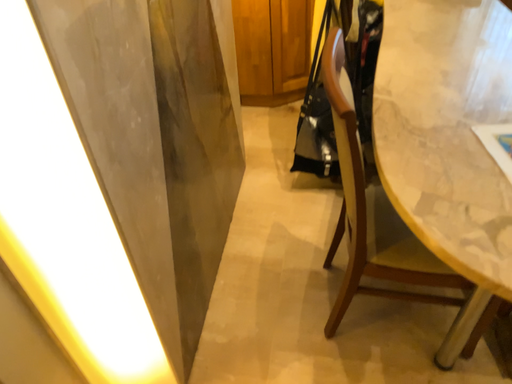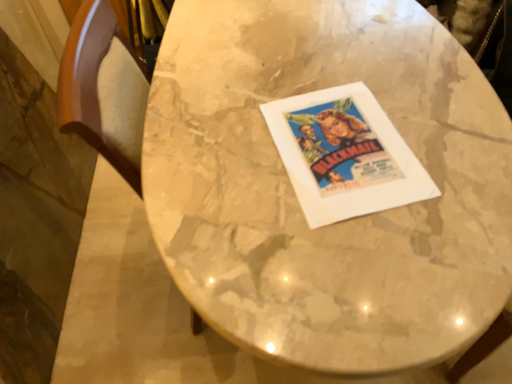
Question: How did the camera likely rotate when shooting the video?

Choices:
 (A) rotated right
 (B) rotated left

Answer: (A)